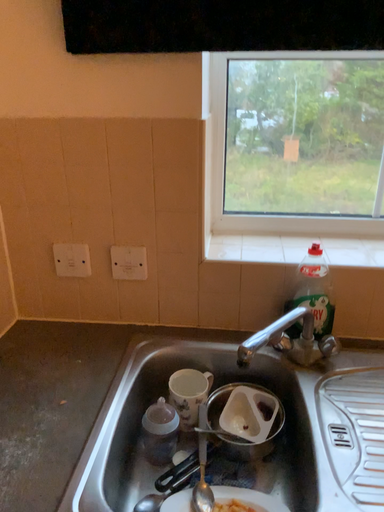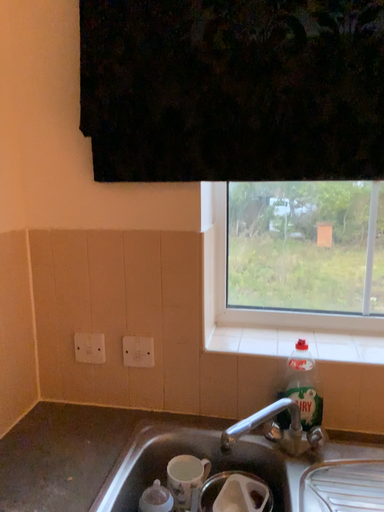
Question: How did the camera likely rotate when shooting the video?

Choices:
 (A) rotated downward
 (B) rotated upward

Answer: (B)